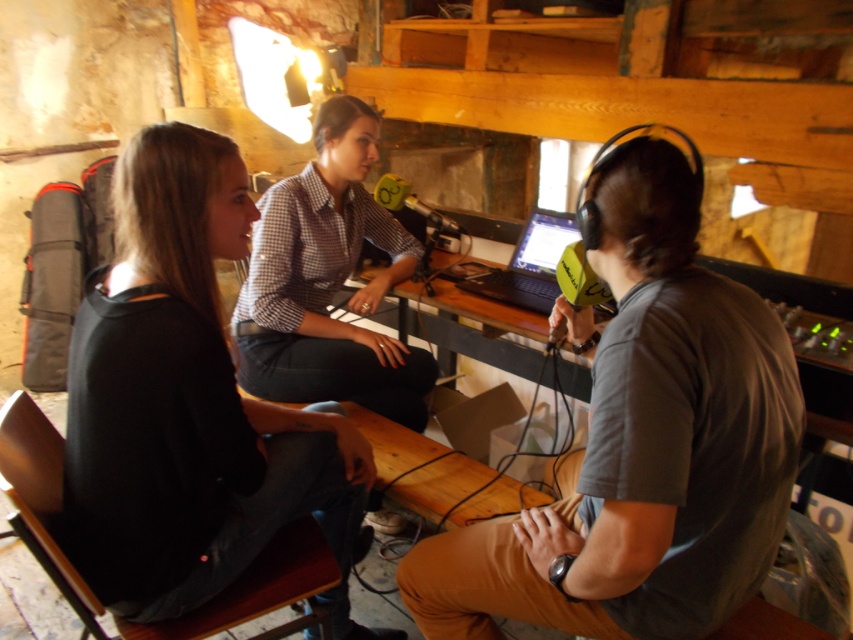
You are a photographer positioned at the center of the room. You want to take a photo of the black matte shirt at left. Where should you aim your camera?

You should aim your camera at point (189, 404) to capture the black matte shirt at left.

You are standing in the rustic barn and want to place a small decoration between the two points labeled point (468, 580) and point (474, 278). Which point should the decoration be closer to in order to appear larger from your current viewpoint?

The decoration should be placed closer to point (468, 580) because it is closer to the camera, making objects placed there appear larger from your viewpoint.

You are a guest on a podcast and need to adjust your microphone stand to be at the same height as the black matte shirt at left. The gray cotton shirt at right is currently lower. How should you adjust the microphone stand?

Raise the microphone stand to match the height of the black matte shirt at left since the gray cotton shirt at right is shorter in height.